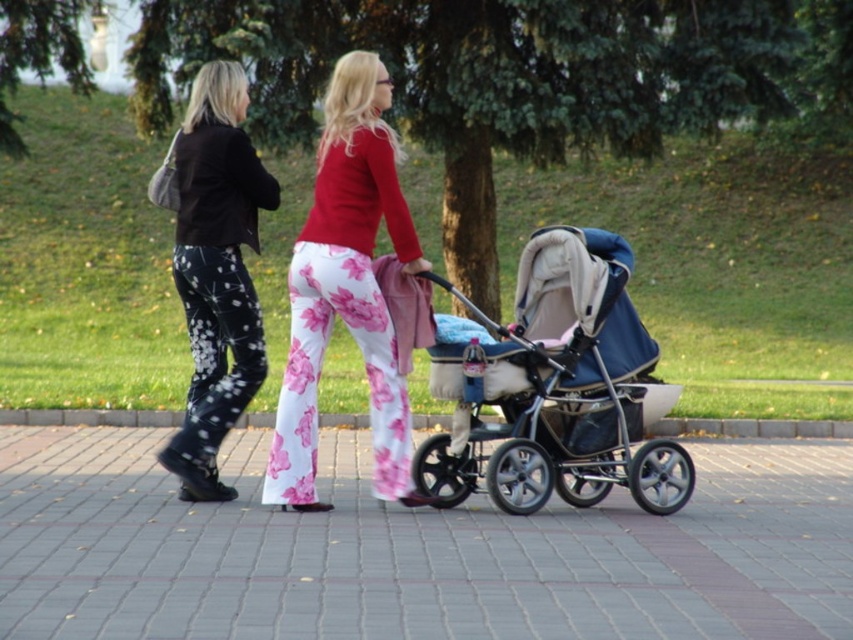
You are a delivery person trying to place a package on the gray concrete pavement at center and the matte floral pants at center. Which surface can you place the package on?

The gray concrete pavement at center is a surface, while the matte floral pants at center are clothing. You can place the package on the gray concrete pavement at center but not on the matte floral pants at center.

You are standing in the park and see two points marked in the image. Which point, point (567, 582) or point (221, 218), is nearer to you?

Point (567, 582) is closer to the viewer than point (221, 218).

You are a pedestrian trying to cross the path. You see the gray concrete pavement at center and the matte floral pants at center. Which object is closer to the left side of the path?

The gray concrete pavement at center is to the left of the matte floral pants at center, so it is closer to the left side of the path.